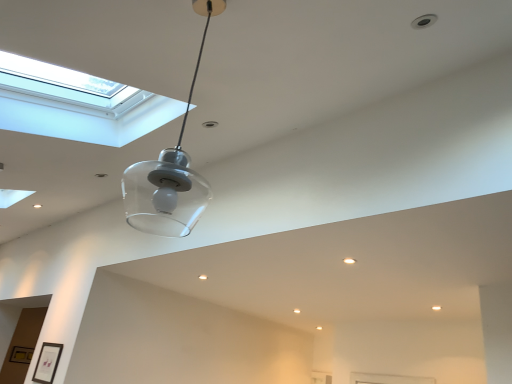
Describe the element at coordinates (47, 363) in the screenshot. The height and width of the screenshot is (384, 512). I see `matte black picture frame at lower left, the first picture frame from the right` at that location.

Locate an element on the screen. transparent glass pendant light at center is located at coordinates (169, 174).

Where is `transparent glass window at upper left`? This screenshot has height=384, width=512. transparent glass window at upper left is located at coordinates (77, 104).

Where is `matte black picture frame at lower left, the first picture frame from the right`? This screenshot has height=384, width=512. matte black picture frame at lower left, the first picture frame from the right is located at coordinates (47, 363).

From the image's perspective, is gold metallic picture frame at lower left, marked as the first picture frame in a bottom-to-top arrangement, located above or below transparent glass pendant light at center?

From the image's perspective, gold metallic picture frame at lower left, marked as the first picture frame in a bottom-to-top arrangement, appears below transparent glass pendant light at center.

Would you say transparent glass pendant light at center is part of gold metallic picture frame at lower left, the first picture frame from the back,'s contents?

No, transparent glass pendant light at center is not surrounded by gold metallic picture frame at lower left, the first picture frame from the back.

From the transparent glass pendant light at center, count 2nd picture frames backward and point to it. Please provide its 2D coordinates.

[(21, 354)]

Can you tell me how much gold metallic picture frame at lower left, which is the 2th picture frame in front-to-back order, and transparent glass pendant light at center differ in facing direction?

90.4 degrees separate the facing orientations of gold metallic picture frame at lower left, which is the 2th picture frame in front-to-back order, and transparent glass pendant light at center.

Is transparent glass window at upper left shorter than matte black picture frame at lower left, positioned as the first picture frame in top-to-bottom order?

Incorrect, the height of transparent glass window at upper left does not fall short of that of matte black picture frame at lower left, positioned as the first picture frame in top-to-bottom order.

From the image's perspective, between transparent glass window at upper left and matte black picture frame at lower left, which is the second picture frame in back-to-front order, which one is located above?

From the image's view, transparent glass window at upper left is above.

Between transparent glass window at upper left and matte black picture frame at lower left, acting as the first picture frame starting from the front, which one has smaller width?

With smaller width is matte black picture frame at lower left, acting as the first picture frame starting from the front.

From a real-world perspective, between transparent glass window at upper left and matte black picture frame at lower left, the 2th picture frame from the left, who is vertically lower?

In real-world perspective, matte black picture frame at lower left, the 2th picture frame from the left, is lower.

The image size is (512, 384). I want to click on picture frame in front of the gold metallic picture frame at lower left, acting as the 2th picture frame starting from the top, so click(x=47, y=363).

Considering the sizes of matte black picture frame at lower left, acting as the first picture frame starting from the front, and gold metallic picture frame at lower left, which ranks as the 2th picture frame in right-to-left order, in the image, is matte black picture frame at lower left, acting as the first picture frame starting from the front, wider or thinner than gold metallic picture frame at lower left, which ranks as the 2th picture frame in right-to-left order,?

Clearly, matte black picture frame at lower left, acting as the first picture frame starting from the front, has less width compared to gold metallic picture frame at lower left, which ranks as the 2th picture frame in right-to-left order.

Considering the relative sizes of matte black picture frame at lower left, the 2th picture frame from the left, and gold metallic picture frame at lower left, which is the 2th picture frame in front-to-back order, in the image provided, is matte black picture frame at lower left, the 2th picture frame from the left, bigger than gold metallic picture frame at lower left, which is the 2th picture frame in front-to-back order,?

Indeed, matte black picture frame at lower left, the 2th picture frame from the left, has a larger size compared to gold metallic picture frame at lower left, which is the 2th picture frame in front-to-back order.

From the picture: Between matte black picture frame at lower left, the 2th picture frame from the left, and gold metallic picture frame at lower left, which is counted as the first picture frame, starting from the left, which one is positioned in front?

matte black picture frame at lower left, the 2th picture frame from the left, is more forward.

Based on the photo, between transparent glass pendant light at center and transparent glass window at upper left, which one appears on the right side from the viewer's perspective?

From the viewer's perspective, transparent glass pendant light at center appears more on the right side.

Is transparent glass window at upper left located within transparent glass pendant light at center?

No, transparent glass window at upper left is not a part of transparent glass pendant light at center.

Find the location of a particular element. window above the transparent glass pendant light at center (from the image's perspective) is located at coordinates (77, 104).

Considering the sizes of transparent glass pendant light at center and transparent glass window at upper left in the image, is transparent glass pendant light at center taller or shorter than transparent glass window at upper left?

Clearly, transparent glass pendant light at center is taller compared to transparent glass window at upper left.

Can you confirm if gold metallic picture frame at lower left, marked as the first picture frame in a bottom-to-top arrangement, is positioned to the right of matte black picture frame at lower left, arranged as the second picture frame when ordered from the bottom?

In fact, gold metallic picture frame at lower left, marked as the first picture frame in a bottom-to-top arrangement, is to the left of matte black picture frame at lower left, arranged as the second picture frame when ordered from the bottom.

How different are the orientations of gold metallic picture frame at lower left, which is counted as the first picture frame, starting from the left, and matte black picture frame at lower left, the first picture frame from the right, in degrees?

There is a 87.3-degree angle between the facing directions of gold metallic picture frame at lower left, which is counted as the first picture frame, starting from the left, and matte black picture frame at lower left, the first picture frame from the right.

From a real-world perspective, is gold metallic picture frame at lower left, marked as the first picture frame in a bottom-to-top arrangement, positioned above or below matte black picture frame at lower left, the first picture frame from the right?

Clearly, from a real-world perspective, gold metallic picture frame at lower left, marked as the first picture frame in a bottom-to-top arrangement, is above matte black picture frame at lower left, the first picture frame from the right.

Which object is further away from the camera taking this photo, gold metallic picture frame at lower left, which is counted as the first picture frame, starting from the left, or matte black picture frame at lower left, the 2th picture frame from the left?

gold metallic picture frame at lower left, which is counted as the first picture frame, starting from the left, is further away from the camera.

Is transparent glass pendant light at center at the left side of gold metallic picture frame at lower left, the first picture frame from the back?

In fact, transparent glass pendant light at center is to the right of gold metallic picture frame at lower left, the first picture frame from the back.

Does transparent glass pendant light at center turn towards gold metallic picture frame at lower left, marked as the first picture frame in a bottom-to-top arrangement?

No, transparent glass pendant light at center does not turn towards gold metallic picture frame at lower left, marked as the first picture frame in a bottom-to-top arrangement.

How distant is transparent glass pendant light at center from gold metallic picture frame at lower left, the first picture frame from the back?

The distance of transparent glass pendant light at center from gold metallic picture frame at lower left, the first picture frame from the back, is 8.28 feet.

There is a transparent glass pendant light at center. Where is `the 2nd picture frame below it (from the image's perspective)`? This screenshot has width=512, height=384. the 2nd picture frame below it (from the image's perspective) is located at coordinates (21, 354).

Is the surface of transparent glass window at upper left in direct contact with gold metallic picture frame at lower left, acting as the 2th picture frame starting from the top?

No, transparent glass window at upper left is not with gold metallic picture frame at lower left, acting as the 2th picture frame starting from the top.

In the scene shown: Which of these two, transparent glass window at upper left or gold metallic picture frame at lower left, which ranks as the 2th picture frame in right-to-left order, stands taller?

transparent glass window at upper left is taller.

Considering the positions of points (16, 121) and (17, 359), is point (16, 121) closer to camera compared to point (17, 359)?

Yes.

Where is `picture frame that is the 2nd object located below the transparent glass pendant light at center (from the image's perspective)`? picture frame that is the 2nd object located below the transparent glass pendant light at center (from the image's perspective) is located at coordinates (21, 354).

Where is `window located above the matte black picture frame at lower left, the first picture frame from the right (from a real-world perspective)`? window located above the matte black picture frame at lower left, the first picture frame from the right (from a real-world perspective) is located at coordinates (77, 104).

From the image, which object appears to be farther from transparent glass pendant light at center, transparent glass window at upper left or gold metallic picture frame at lower left, which ranks as the 2th picture frame in right-to-left order?

Among the two, gold metallic picture frame at lower left, which ranks as the 2th picture frame in right-to-left order, is located further to transparent glass pendant light at center.

Looking at this image, looking at the image, which one is located closer to gold metallic picture frame at lower left, acting as the 2th picture frame starting from the top, transparent glass window at upper left or matte black picture frame at lower left, the 2th picture frame from the left?

matte black picture frame at lower left, the 2th picture frame from the left, is closer to gold metallic picture frame at lower left, acting as the 2th picture frame starting from the top.

Which object lies nearer to the anchor point matte black picture frame at lower left, the first picture frame from the right, gold metallic picture frame at lower left, the first picture frame from the back, or transparent glass window at upper left?

The object closer to matte black picture frame at lower left, the first picture frame from the right, is gold metallic picture frame at lower left, the first picture frame from the back.

Estimate the real-world distances between objects in this image. Which object is closer to transparent glass window at upper left, gold metallic picture frame at lower left, acting as the 2th picture frame starting from the top, or matte black picture frame at lower left, the 2th picture frame from the left?

Based on the image, matte black picture frame at lower left, the 2th picture frame from the left, appears to be nearer to transparent glass window at upper left.

Considering their positions, is transparent glass window at upper left positioned closer to matte black picture frame at lower left, acting as the first picture frame starting from the front, than transparent glass pendant light at center?

Based on the image, transparent glass pendant light at center appears to be nearer to matte black picture frame at lower left, acting as the first picture frame starting from the front.

Looking at the image, which one is located closer to transparent glass pendant light at center, matte black picture frame at lower left, acting as the first picture frame starting from the front, or gold metallic picture frame at lower left, which is counted as the first picture frame, starting from the left?

The object closer to transparent glass pendant light at center is matte black picture frame at lower left, acting as the first picture frame starting from the front.

Looking at the image, which one is located closer to transparent glass window at upper left, gold metallic picture frame at lower left, the first picture frame from the back, or transparent glass pendant light at center?

transparent glass pendant light at center lies closer to transparent glass window at upper left than the other object.

Looking at this image, from the image, which object appears to be farther from transparent glass window at upper left, matte black picture frame at lower left, the 2th picture frame from the left, or transparent glass pendant light at center?

Based on the image, matte black picture frame at lower left, the 2th picture frame from the left, appears to be further to transparent glass window at upper left.

I want to click on picture frame between transparent glass window at upper left and gold metallic picture frame at lower left, which is counted as the first picture frame, starting from the left, in the front-back direction, so click(47, 363).

The image size is (512, 384). Identify the location of picture frame between transparent glass pendant light at center and gold metallic picture frame at lower left, which is counted as the first picture frame, starting from the left, in the front-back direction. (47, 363).

Where is `window located between transparent glass pendant light at center and gold metallic picture frame at lower left, marked as the first picture frame in a bottom-to-top arrangement, in the depth direction`? This screenshot has width=512, height=384. window located between transparent glass pendant light at center and gold metallic picture frame at lower left, marked as the first picture frame in a bottom-to-top arrangement, in the depth direction is located at coordinates (77, 104).

In order to click on window between transparent glass pendant light at center and matte black picture frame at lower left, arranged as the second picture frame when ordered from the bottom, in the front-back direction in this screenshot , I will do pos(77,104).